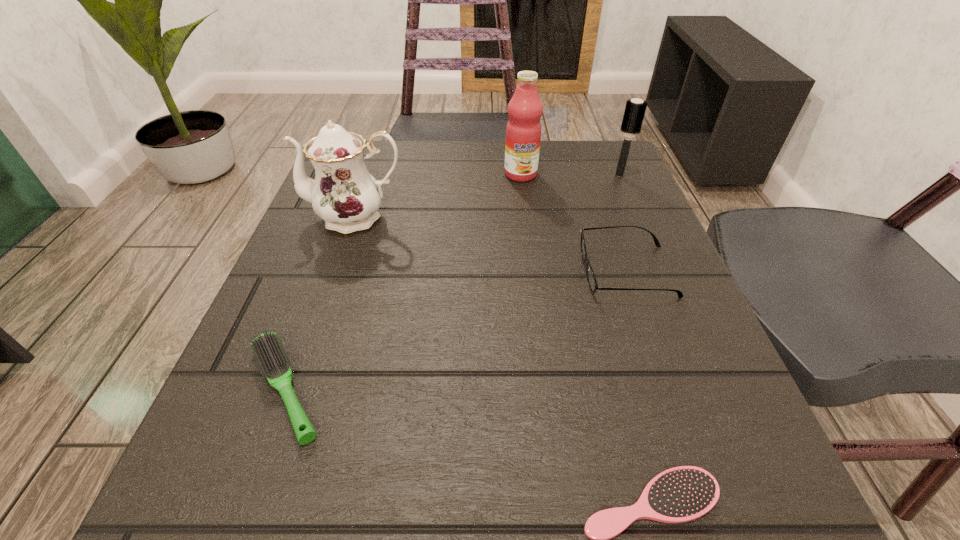
Find the location of a particular element. The image size is (960, 540). fruit juice is located at coordinates (523, 131).

You are a GUI agent. You are given a task and a screenshot of the screen. Output one action in this format:
    pyautogui.click(x=<x>, y=<y>)
    Task: Click on the fourth nearest object
    The width and height of the screenshot is (960, 540).
    Given the screenshot: What is the action you would take?
    pyautogui.click(x=344, y=194)

The height and width of the screenshot is (540, 960). Identify the location of the rightmost hairbrush. (635, 109).

Locate an element on the screen. Image resolution: width=960 pixels, height=540 pixels. the farthest hairbrush is located at coordinates (635, 109).

Where is `the third nearest object`? the third nearest object is located at coordinates (591, 279).

Find the location of `the second tallest hairbrush`. the second tallest hairbrush is located at coordinates coord(267,348).

Identify the location of the second farthest hairbrush. This screenshot has width=960, height=540. (267, 348).

The height and width of the screenshot is (540, 960). I want to click on vacant area located 0.120m on the label of the fruit juice, so point(526,218).

Locate an element on the screen. The height and width of the screenshot is (540, 960). vacant space situated 0.120m on the back of the chinaware is located at coordinates (372, 167).

Find the location of a particular element. This screenshot has width=960, height=540. vacant space located on the left of the farthest hairbrush is located at coordinates (478, 176).